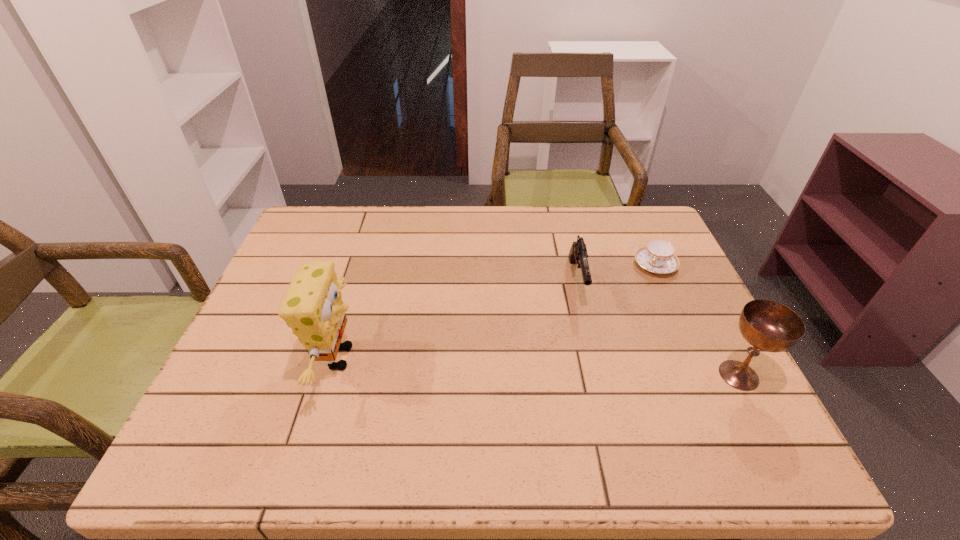
You are a GUI agent. You are given a task and a screenshot of the screen. Output one action in this format:
    pyautogui.click(x=<x>, y=<y>)
    Task: Click on the vacant space on the desktop that is between the tallest object and the second tallest object and is positioned at the end of the barrel of the second object from left to right
    
    Given the screenshot: What is the action you would take?
    pyautogui.click(x=592, y=369)

Locate an element on the screen. This screenshot has height=540, width=960. free space on the desktop that is between the sponge and the third shortest object and is positioned on the side with the handle of the shortest object is located at coordinates (588, 368).